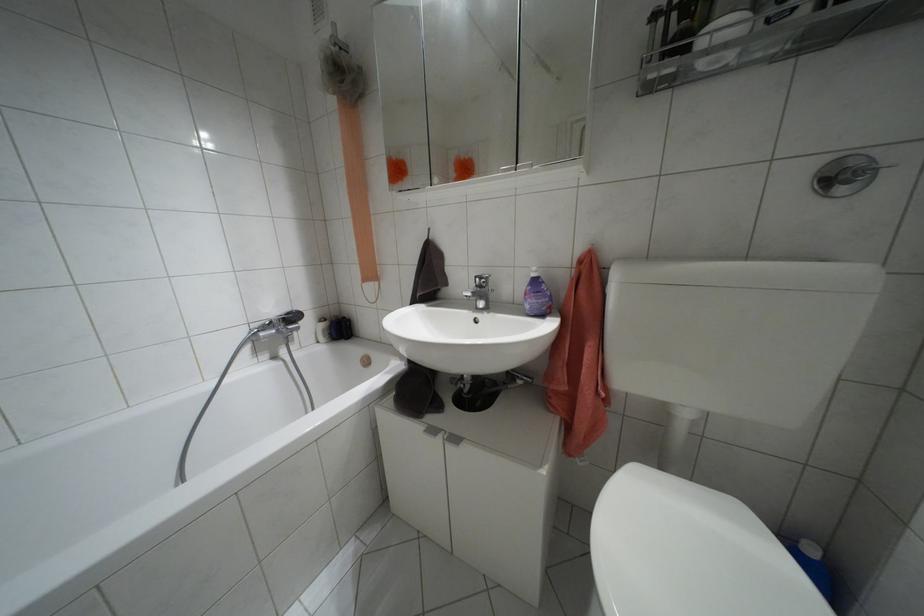
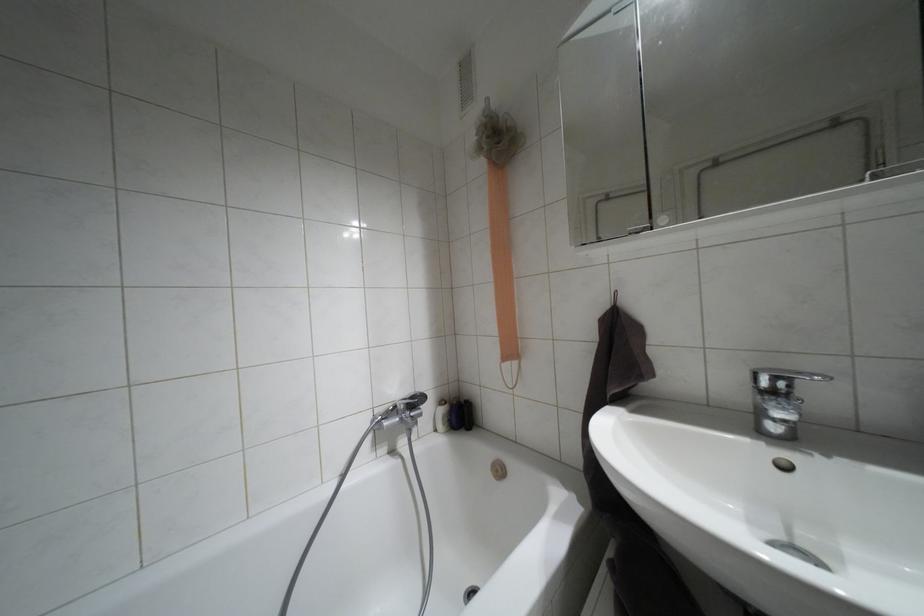
Question: The camera is either moving clockwise (left) or counter-clockwise (right) around the object. The first image is from the beginning of the video and the second image is from the end. Is the camera moving left or right when shooting the video?

Choices:
 (A) Left
 (B) Right

Answer: (B)